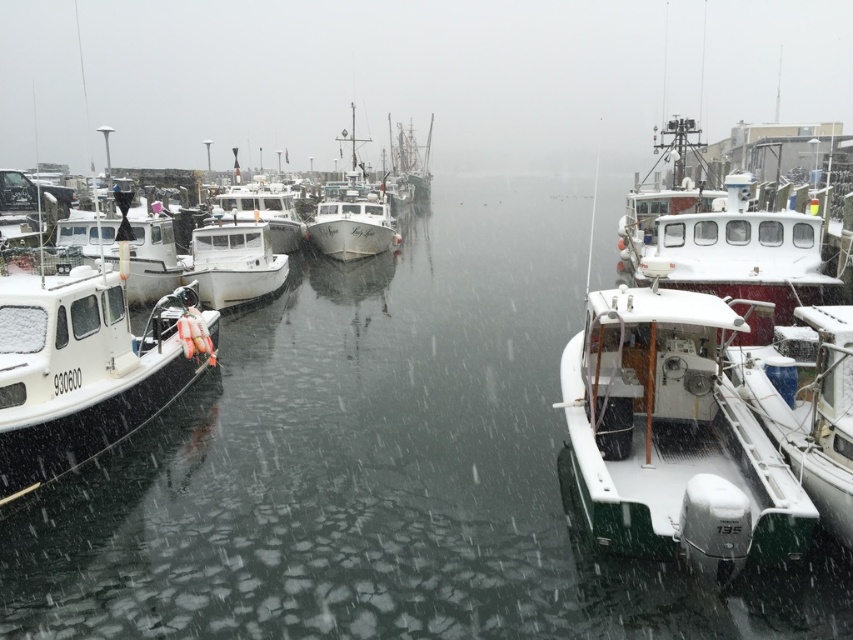
In the scene shown: You are standing at the edge of the marina and want to board the white matte boat at center and the white matte boat at right. Which boat will you reach first without walking around any other boats?

The white matte boat at center is closer to the viewer than the white matte boat at right, so you will reach the white matte boat at center first.